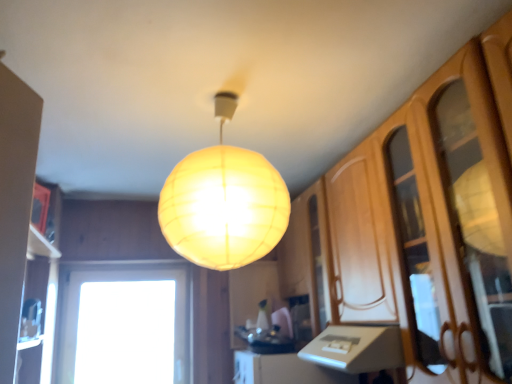
Question: Is wooden cabinet at right completely or partially outside of translucent yellow sphere at center?

Choices:
 (A) yes
 (B) no

Answer: (A)

Question: Considering the relative positions of wooden cabinet at right and translucent yellow sphere at center in the image provided, is wooden cabinet at right to the left of translucent yellow sphere at center from the viewer's perspective?

Choices:
 (A) no
 (B) yes

Answer: (A)

Question: From the image's perspective, is wooden cabinet at right located beneath translucent yellow sphere at center?

Choices:
 (A) no
 (B) yes

Answer: (B)

Question: Is wooden cabinet at right shorter than translucent yellow sphere at center?

Choices:
 (A) yes
 (B) no

Answer: (B)

Question: Does wooden cabinet at right have a greater width compared to translucent yellow sphere at center?

Choices:
 (A) yes
 (B) no

Answer: (B)

Question: From a real-world perspective, relative to translucent yellow sphere at center, is wooden cabinet at right vertically above or below?

Choices:
 (A) below
 (B) above

Answer: (A)

Question: Is wooden cabinet at right to the left or to the right of translucent yellow sphere at center in the image?

Choices:
 (A) left
 (B) right

Answer: (B)

Question: Is wooden cabinet at right taller or shorter than translucent yellow sphere at center?

Choices:
 (A) short
 (B) tall

Answer: (B)

Question: Based on their sizes in the image, would you say wooden cabinet at right is bigger or smaller than translucent yellow sphere at center?

Choices:
 (A) big
 (B) small

Answer: (A)

Question: From a real-world perspective, is transparent glass window at lower left positioned above or below translucent yellow sphere at center?

Choices:
 (A) above
 (B) below

Answer: (B)

Question: From the image's perspective, is transparent glass window at lower left positioned above or below translucent yellow sphere at center?

Choices:
 (A) below
 (B) above

Answer: (A)

Question: Would you say transparent glass window at lower left is inside or outside translucent yellow sphere at center?

Choices:
 (A) outside
 (B) inside

Answer: (A)

Question: In terms of height, does transparent glass window at lower left look taller or shorter compared to translucent yellow sphere at center?

Choices:
 (A) short
 (B) tall

Answer: (B)

Question: In the image, is translucent yellow sphere at center positioned in front of or behind wooden cabinet at right?

Choices:
 (A) front
 (B) behind

Answer: (B)

Question: Based on their positions, is translucent yellow sphere at center located to the left or right of wooden cabinet at right?

Choices:
 (A) left
 (B) right

Answer: (A)